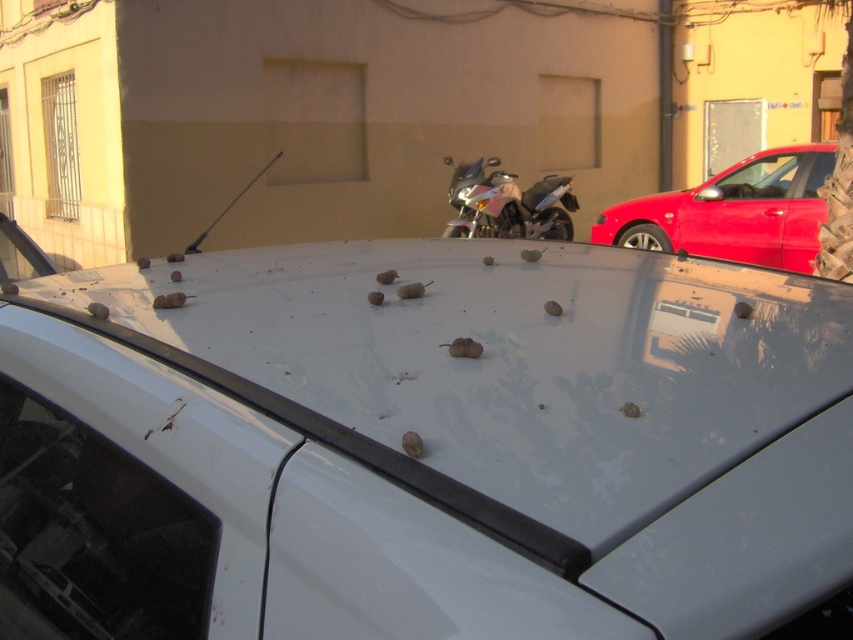
Looking at this image, between transparent glass windshield at lower left and shiny red car at upper right, which one is positioned lower?

transparent glass windshield at lower left is lower down.

Which of these two, transparent glass windshield at lower left or shiny red car at upper right, stands taller?

shiny red car at upper right

Locate an element on the screen. Image resolution: width=853 pixels, height=640 pixels. transparent glass windshield at lower left is located at coordinates (94, 532).

This screenshot has height=640, width=853. Describe the element at coordinates (421, 445) in the screenshot. I see `white glossy car at center` at that location.

Is white glossy car at center smaller than shiny red car at upper right?

Correct, white glossy car at center occupies less space than shiny red car at upper right.

This screenshot has height=640, width=853. What do you see at coordinates (421, 445) in the screenshot?
I see `white glossy car at center` at bounding box center [421, 445].

At what (x,y) coordinates should I click in order to perform the action: click on white glossy car at center. Please return your answer as a coordinate pair (x, y). Looking at the image, I should click on (421, 445).

Can you confirm if shiny red car at upper right is bigger than shiny metallic motorcycle at center?

Yes.

I want to click on shiny red car at upper right, so click(x=734, y=211).

Which is behind, point (781, 237) or point (560, 228)?

Positioned behind is point (560, 228).

In order to click on shiny red car at upper right in this screenshot , I will do click(734, 211).